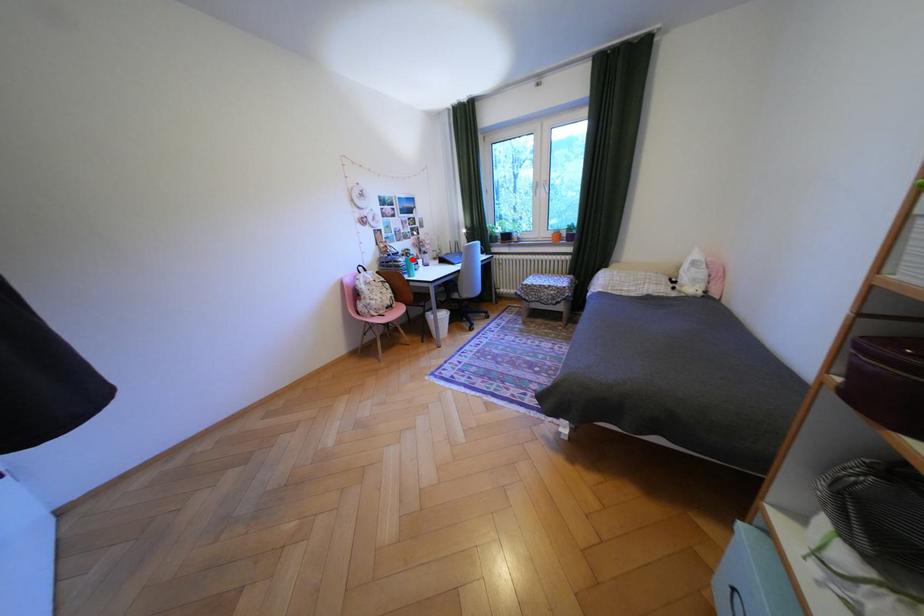
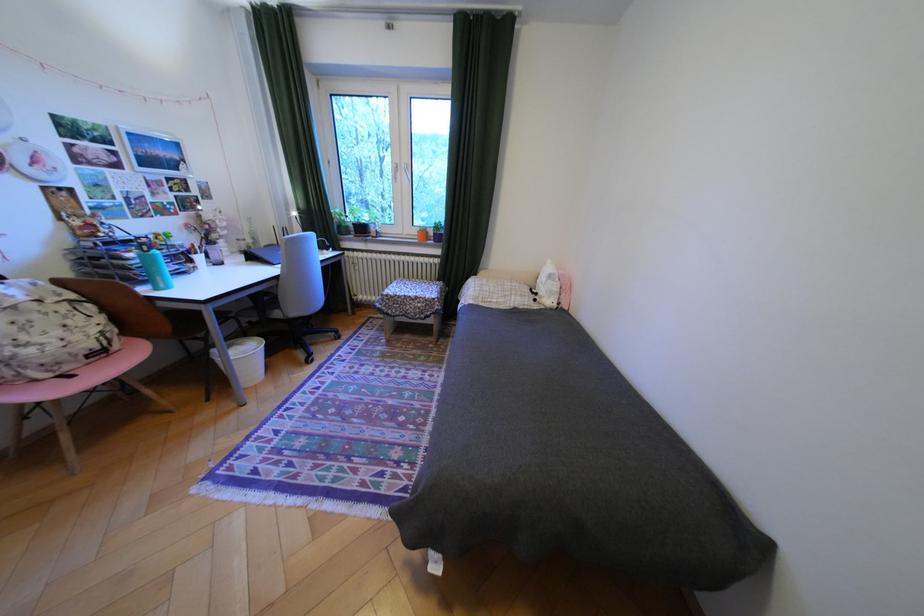
Locate, in the second image, the point that corresponds to the highlighted location in the first image.

(140, 254)